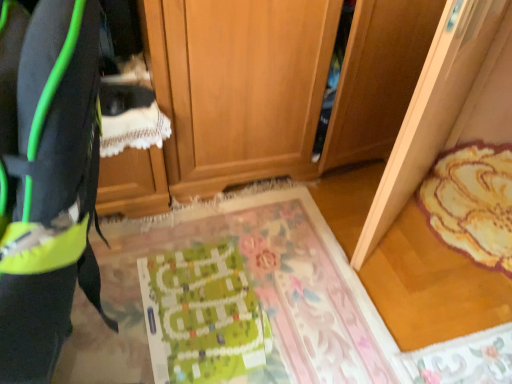
Question: Is wooden cabinet at center beside neon green fabric at left?

Choices:
 (A) no
 (B) yes

Answer: (A)

Question: Can you confirm if wooden cabinet at center is wider than neon green fabric at left?

Choices:
 (A) yes
 (B) no

Answer: (A)

Question: Does wooden cabinet at center have a lesser height compared to neon green fabric at left?

Choices:
 (A) no
 (B) yes

Answer: (A)

Question: Can neon green fabric at left be found inside wooden cabinet at center?

Choices:
 (A) yes
 (B) no

Answer: (B)

Question: Are wooden cabinet at center and neon green fabric at left far apart?

Choices:
 (A) yes
 (B) no

Answer: (A)

Question: From the image's perspective, would you say wooden cabinet at center is shown under neon green fabric at left?

Choices:
 (A) no
 (B) yes

Answer: (A)

Question: Does green fabric mat at center, which is the second mat in right-to-left order, come behind neon green fabric at left?

Choices:
 (A) no
 (B) yes

Answer: (B)

Question: Is green fabric mat at center, which is the second mat in right-to-left order, facing towards neon green fabric at left?

Choices:
 (A) yes
 (B) no

Answer: (B)

Question: Considering the relative positions of green fabric mat at center, which is the second mat in right-to-left order, and neon green fabric at left in the image provided, is green fabric mat at center, which is the second mat in right-to-left order, to the right of neon green fabric at left from the viewer's perspective?

Choices:
 (A) yes
 (B) no

Answer: (A)

Question: Is green fabric mat at center, arranged as the 1th mat when viewed from the left, bigger than neon green fabric at left?

Choices:
 (A) no
 (B) yes

Answer: (A)

Question: From the image's perspective, is green fabric mat at center, arranged as the 1th mat when viewed from the left, beneath neon green fabric at left?

Choices:
 (A) no
 (B) yes

Answer: (B)

Question: Considering the relative sizes of green fabric mat at center, which is the second mat in right-to-left order, and neon green fabric at left in the image provided, is green fabric mat at center, which is the second mat in right-to-left order, smaller than neon green fabric at left?

Choices:
 (A) yes
 (B) no

Answer: (A)

Question: Is green fabric mat at center, which is the second mat in right-to-left order, closer to the viewer compared to green paper at center?

Choices:
 (A) no
 (B) yes

Answer: (B)